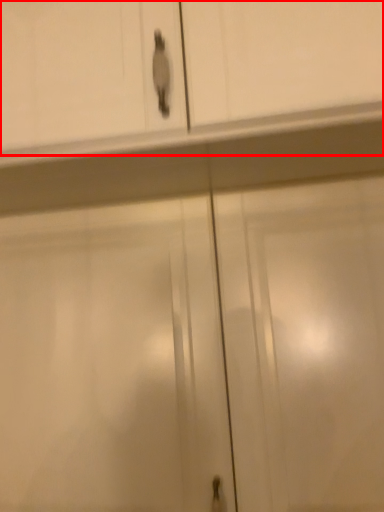
Question: Observing the image, what is the correct spatial positioning of cabinetry (annotated by the red box) in reference to screen door?

Choices:
 (A) left
 (B) right

Answer: (A)